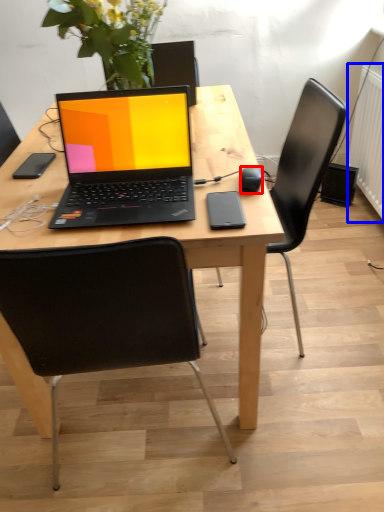
Question: Which of the following is the closest to the observer, computer mouse (highlighted by a red box) or radiator (highlighted by a blue box)?

Choices:
 (A) computer mouse
 (B) radiator

Answer: (A)